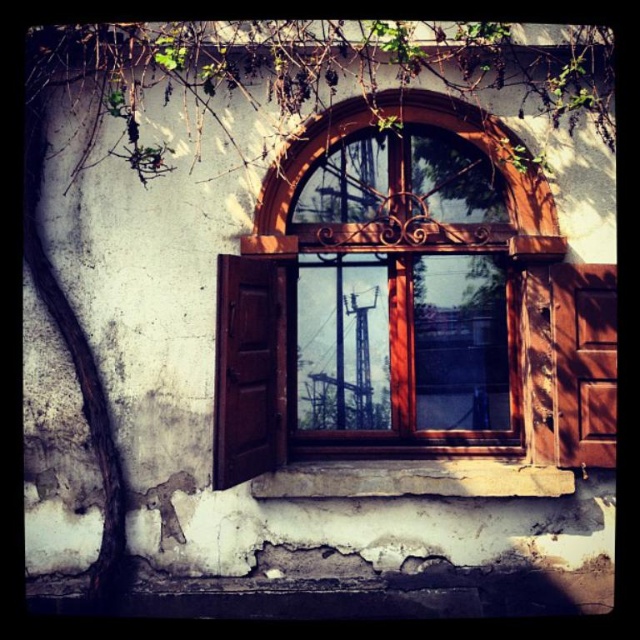
Question: Among these objects, which one is farthest from the camera?

Choices:
 (A) green leafy vine at upper center
 (B) wooden at lower center

Answer: (B)

Question: Is wooden window at center further to camera compared to green leafy vine at upper center?

Choices:
 (A) no
 (B) yes

Answer: (B)

Question: Among these points, which one is nearest to the camera?

Choices:
 (A) (609, 140)
 (B) (420, 196)
 (C) (422, 460)

Answer: (A)

Question: From the image, what is the correct spatial relationship of wooden window at center in relation to wooden at lower center?

Choices:
 (A) below
 (B) above

Answer: (B)

Question: Based on their relative distances, which object is farther from the wooden at lower center?

Choices:
 (A) wooden window at center
 (B) green leafy vine at upper center

Answer: (B)

Question: Can you confirm if green leafy vine at upper center is positioned below wooden at lower center?

Choices:
 (A) no
 (B) yes

Answer: (A)